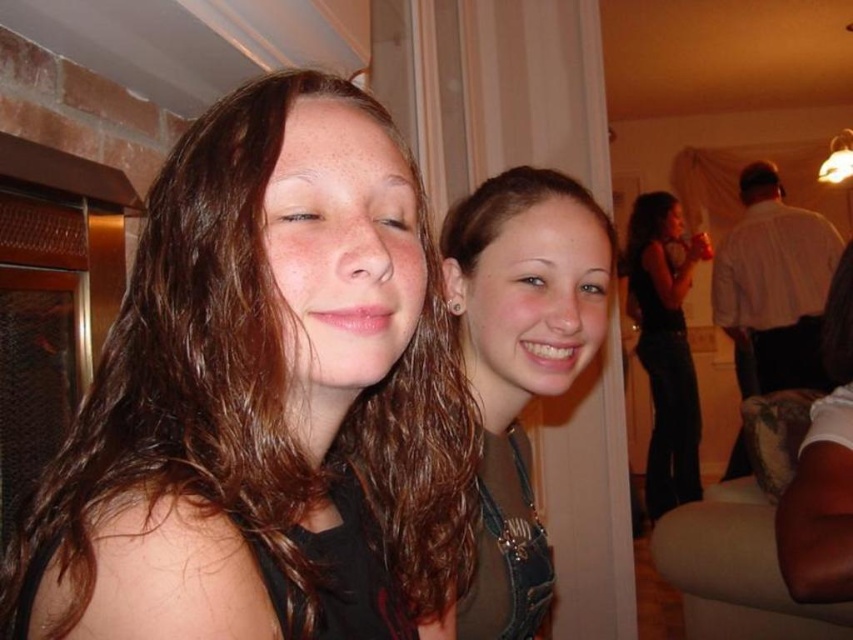
Question: Is black denim jeans at right further to the viewer compared to brown shiny hair at upper right?

Choices:
 (A) no
 (B) yes

Answer: (B)

Question: Which point is farther from the camera taking this photo?

Choices:
 (A) (582, 349)
 (B) (735, 352)
 (C) (344, 285)
 (D) (683, 355)

Answer: (B)

Question: Which object is positioned farthest from the black denim jeans at right?

Choices:
 (A) brown shiny hair at upper right
 (B) white shirt at upper right
 (C) brown denim overalls at center

Answer: (C)

Question: Where is brown shiny hair at center located in relation to brown shiny hair at upper right in the image?

Choices:
 (A) below
 (B) above

Answer: (A)

Question: Does brown denim overalls at center appear over white shirt at upper right?

Choices:
 (A) no
 (B) yes

Answer: (A)

Question: Which object is the farthest from the white shirt at upper right?

Choices:
 (A) brown shiny hair at center
 (B) brown denim overalls at center
 (C) black denim jeans at right
 (D) brown shiny hair at upper right

Answer: (A)